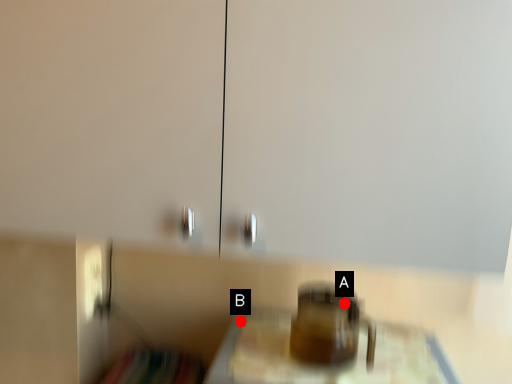
Question: Two points are circled on the image, labeled by A and B beside each circle. Which point is farther to the camera?

Choices:
 (A) A is further
 (B) B is further

Answer: (B)